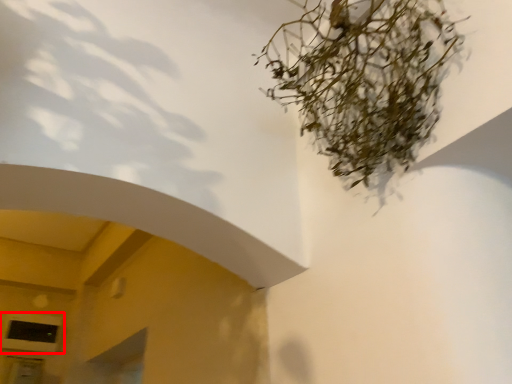
Question: Where is window (annotated by the red box) located in relation to houseplant in the image?

Choices:
 (A) right
 (B) left

Answer: (B)